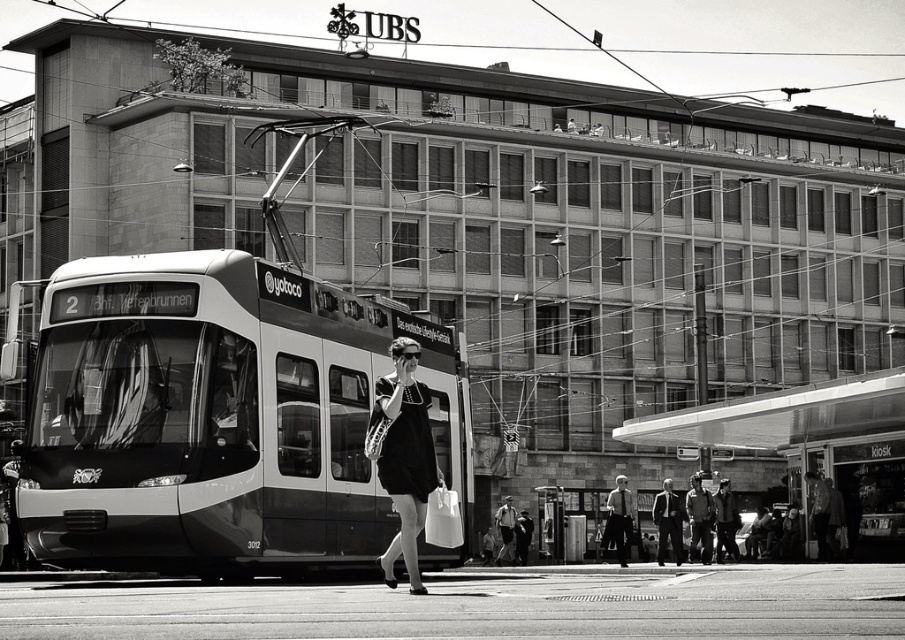
You are a fashion designer observing two jackets in an urban setting. You need to determine which jacket is narrower. The jackets are the smooth leather jacket at lower right and the light gray fabric jacket at center. Which one is narrower?

The smooth leather jacket at lower right has a lesser width compared to the light gray fabric jacket at center, so the smooth leather jacket at lower right is narrower.